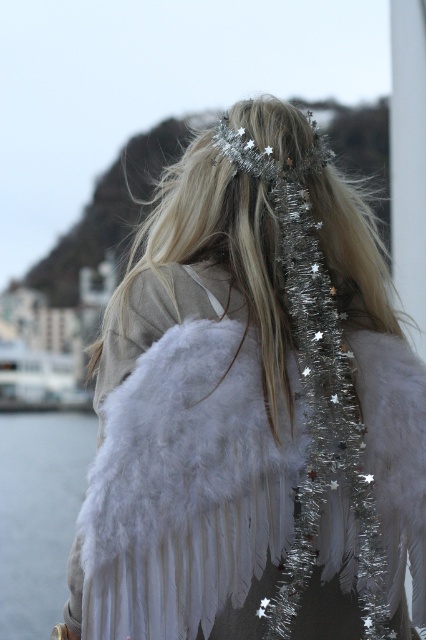
Based on the photo, where are the white feathered wings at center located in the image?

The white feathered wings at center are located at point (252, 408) in the image.

From the picture: You are an event photographer at a winter festival. You need to capture a photo of the white feathered wings at center and the transparent water at lower left in the same frame. Can you fit both objects in the frame if the maximum width your camera can capture is 1.2 meters?

The white feathered wings at center is wider than the transparent water at lower left. Since the wings are wider, if their total width exceeds 1.2 meters, they might not fit. However, if the combined width of both objects together is within 1.2 meters, then yes. But the description only states the wings are wider, not their exact dimensions. Without knowing the exact widths, it is uncertain if both will fit.